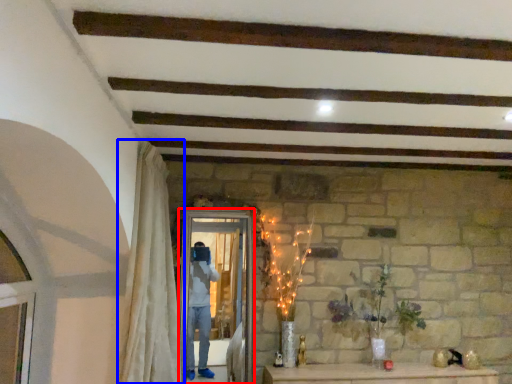
Question: Which of the following is the farthest to the observer, screen door (highlighted by a red box) or curtain (highlighted by a blue box)?

Choices:
 (A) screen door
 (B) curtain

Answer: (A)